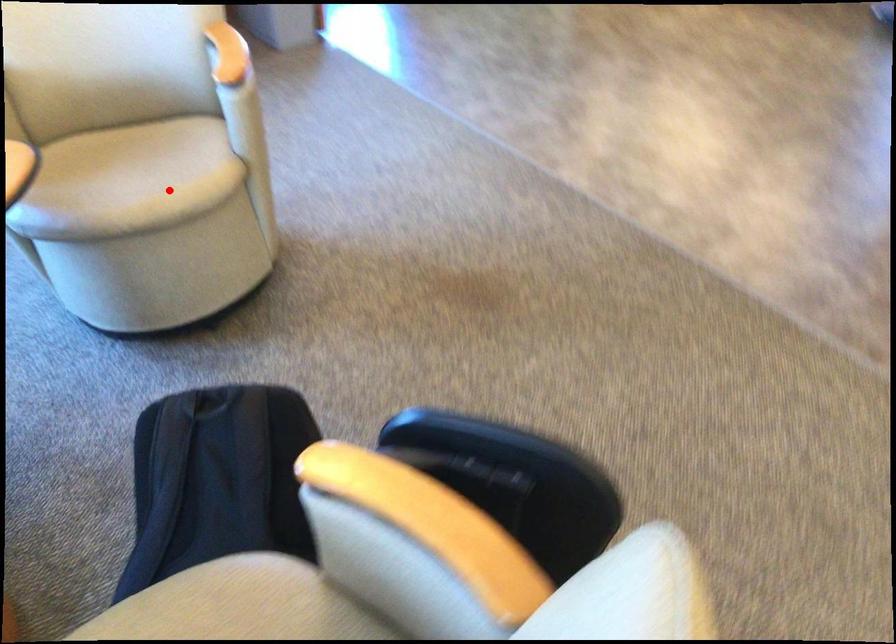
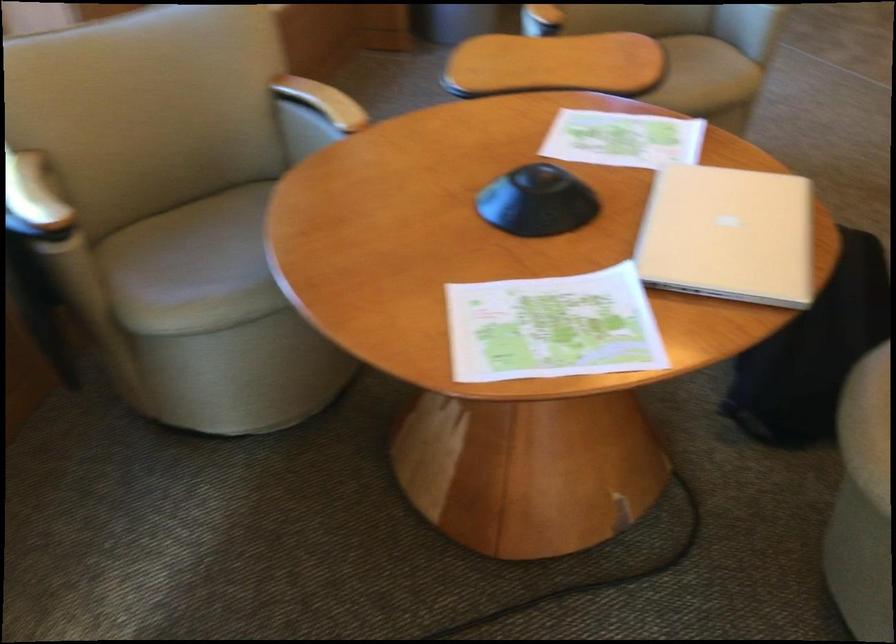
Question: I am providing you with two images of the same scene from different viewpoints. Image1 has a red point marked. In image2, the corresponding 3D location appears at what relative position? Reply with the corresponding letter.

Choices:
 (A) Closer
 (B) Farther

Answer: (B)